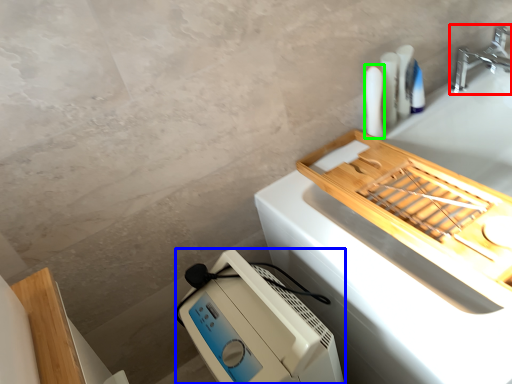
Question: Estimate the real-world distances between objects in this image. Which object is farther from tap (highlighted by a red box), home appliance (highlighted by a blue box) or toiletry (highlighted by a green box)?

Choices:
 (A) home appliance
 (B) toiletry

Answer: (A)